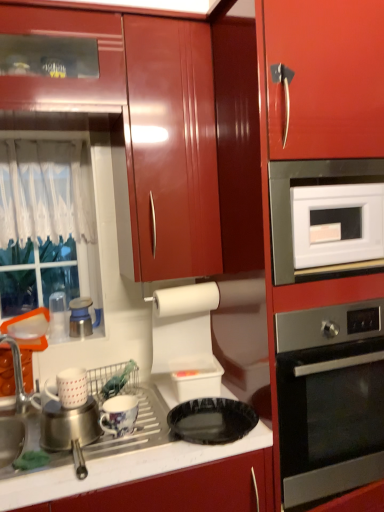
Question: Is glossy wood cabinet at upper center inside the boundaries of satin silver kettle at upper left, which ranks as the third appliance in right-to-left order, or outside?

Choices:
 (A) inside
 (B) outside

Answer: (B)

Question: From a real-world perspective, relative to satin silver kettle at upper left, marked as the third appliance in a bottom-to-top arrangement, is glossy wood cabinet at upper center vertically above or below?

Choices:
 (A) above
 (B) below

Answer: (A)

Question: Which object is the closest to the stainless steel oven at right?

Choices:
 (A) glossy ceramic mug at lower center, marked as the second appliance in a front-to-back arrangement
 (B) brushed metal sink at lower left
 (C) satin silver kettle at upper left, which ranks as the third appliance in right-to-left order
 (D) glossy wood cabinet at upper center
 (E) white sheer curtain at left

Answer: (A)

Question: Based on their relative distances, which object is farther from the brushed metal sink at lower left?

Choices:
 (A) white glossy microwave oven at upper right
 (B) stainless steel oven at right
 (C) glossy ceramic mug at lower center, arranged as the first appliance when viewed from the right
 (D) white matte mug at lower left, the second appliance in the bottom-to-top sequence
 (E) black glossy plate at lower center

Answer: (A)